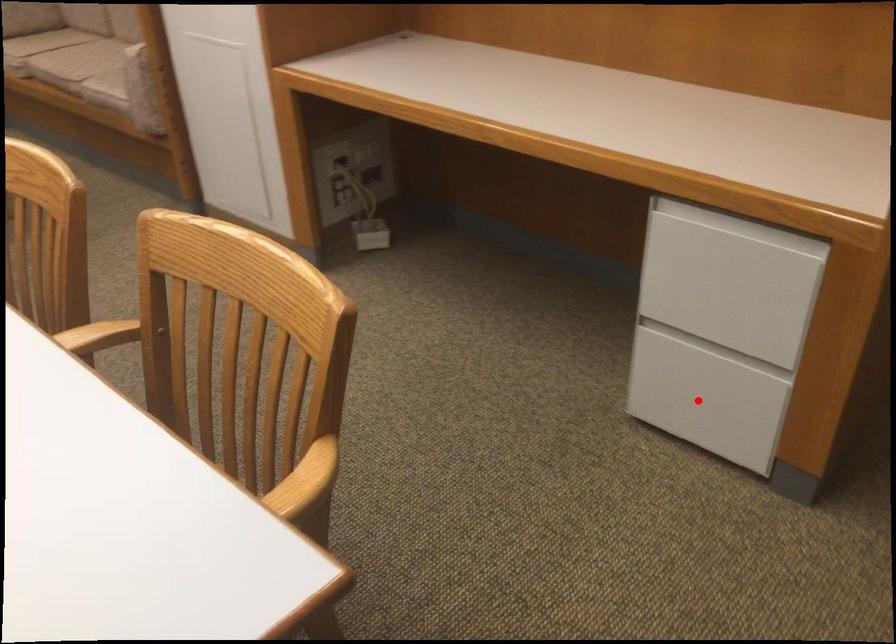
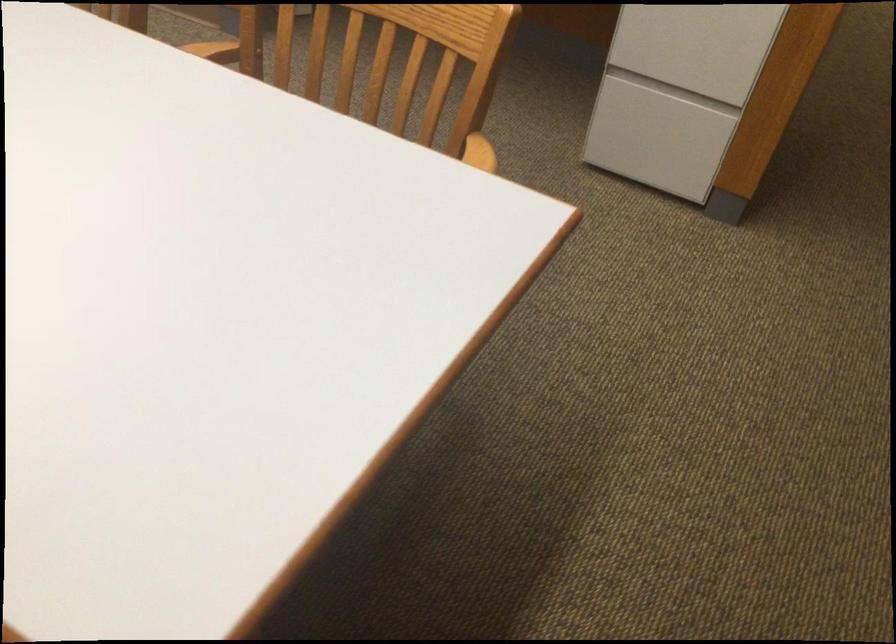
Find the pixel in the second image that matches the highlighted location in the first image.

(661, 140)